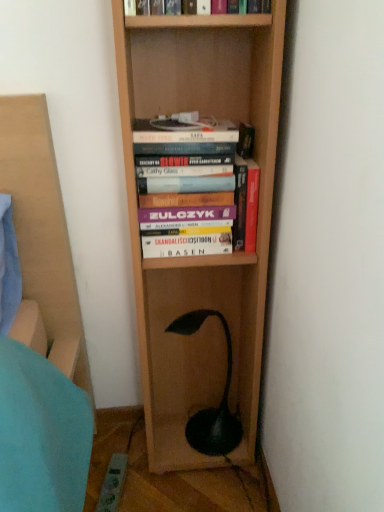
Question: Is hardcover book at center, acting as the 3th book starting from the top, bigger than green matte lamp at lower center?

Choices:
 (A) no
 (B) yes

Answer: (A)

Question: Is hardcover book at center, the first book from the bottom, touching green matte lamp at lower center?

Choices:
 (A) yes
 (B) no

Answer: (B)

Question: Is green matte lamp at lower center a part of hardcover book at center, acting as the 3th book starting from the top?

Choices:
 (A) yes
 (B) no

Answer: (B)

Question: Is hardcover book at center, the first book from the bottom, oriented away from green matte lamp at lower center?

Choices:
 (A) no
 (B) yes

Answer: (A)

Question: Is hardcover book at center, the first book from the bottom, to the left of green matte lamp at lower center from the viewer's perspective?

Choices:
 (A) no
 (B) yes

Answer: (A)

Question: From a real-world perspective, is green matte lamp at lower center above or below hardcover books at center, placed as the 2th book when sorted from bottom to top?

Choices:
 (A) below
 (B) above

Answer: (A)

Question: Considering the positions of green matte lamp at lower center and hardcover books at center, the 2th book viewed from the top, in the image, is green matte lamp at lower center wider or thinner than hardcover books at center, the 2th book viewed from the top,?

Choices:
 (A) thin
 (B) wide

Answer: (B)

Question: Is point (213, 428) positioned closer to the camera than point (178, 200)?

Choices:
 (A) closer
 (B) farther

Answer: (B)

Question: In the image, is green matte lamp at lower center positioned in front of or behind hardcover books at center, placed as the 2th book when sorted from bottom to top?

Choices:
 (A) front
 (B) behind

Answer: (B)

Question: Looking at their shapes, would you say hardcover book at center, acting as the 3th book starting from the top, is wider or thinner than green matte lamp at lower center?

Choices:
 (A) wide
 (B) thin

Answer: (B)

Question: Is hardcover book at center, acting as the 3th book starting from the top, inside or outside of green matte lamp at lower center?

Choices:
 (A) outside
 (B) inside

Answer: (A)

Question: From the image's perspective, is hardcover book at center, the first book from the bottom, above or below green matte lamp at lower center?

Choices:
 (A) below
 (B) above

Answer: (B)

Question: Is point (251, 164) closer or farther from the camera than point (185, 320)?

Choices:
 (A) farther
 (B) closer

Answer: (B)

Question: Based on their sizes in the image, would you say hardcover books at center, placed as the 2th book when sorted from bottom to top, is bigger or smaller than green matte lamp at lower center?

Choices:
 (A) big
 (B) small

Answer: (B)

Question: From the image's perspective, relative to green matte lamp at lower center, is hardcover books at center, placed as the 2th book when sorted from bottom to top, above or below?

Choices:
 (A) below
 (B) above

Answer: (B)